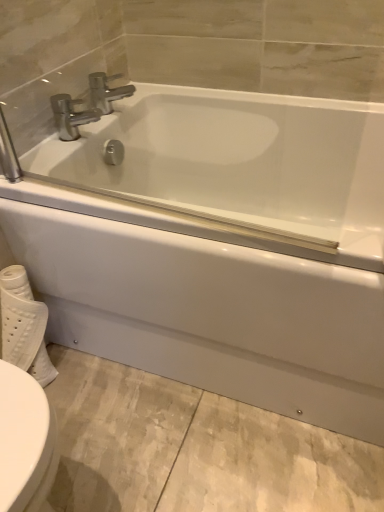
The width and height of the screenshot is (384, 512). Identify the location of vacant area located to the right-hand side of white textured toilet paper at lower left. (95, 387).